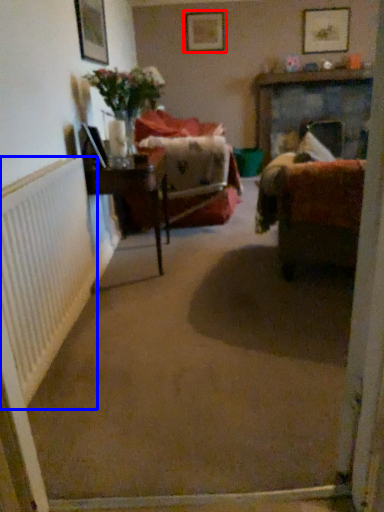
Question: Which point is closer to the camera, picture frame (highlighted by a red box) or radiator (highlighted by a blue box)?

Choices:
 (A) picture frame
 (B) radiator

Answer: (B)